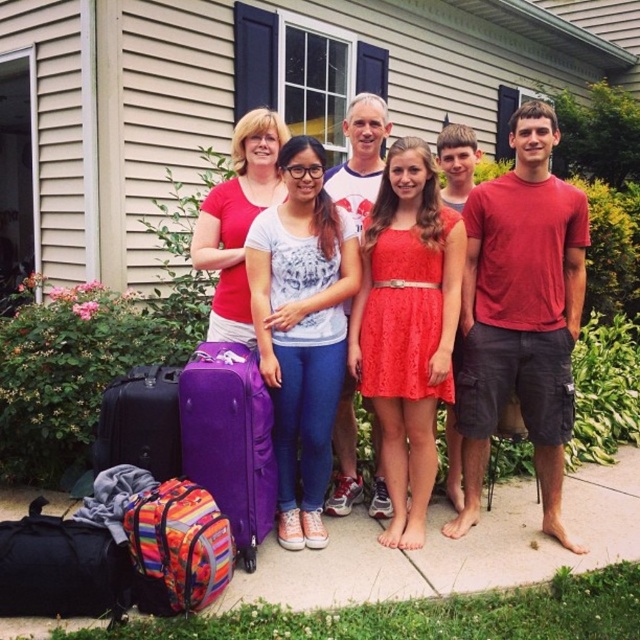
You are standing at the point labeled as point (484, 220) in the image. You want to walk directly towards the viewer. How far will you have to walk to reach the viewer?

The distance between point (484, 220) and the viewer is 3.44 meters, so you will have to walk 3.44 meters to reach the viewer.